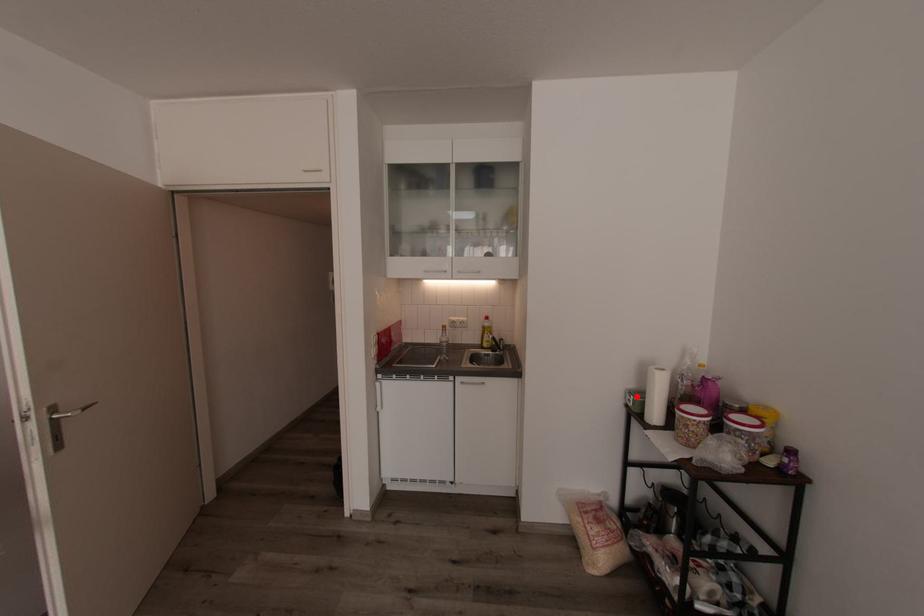
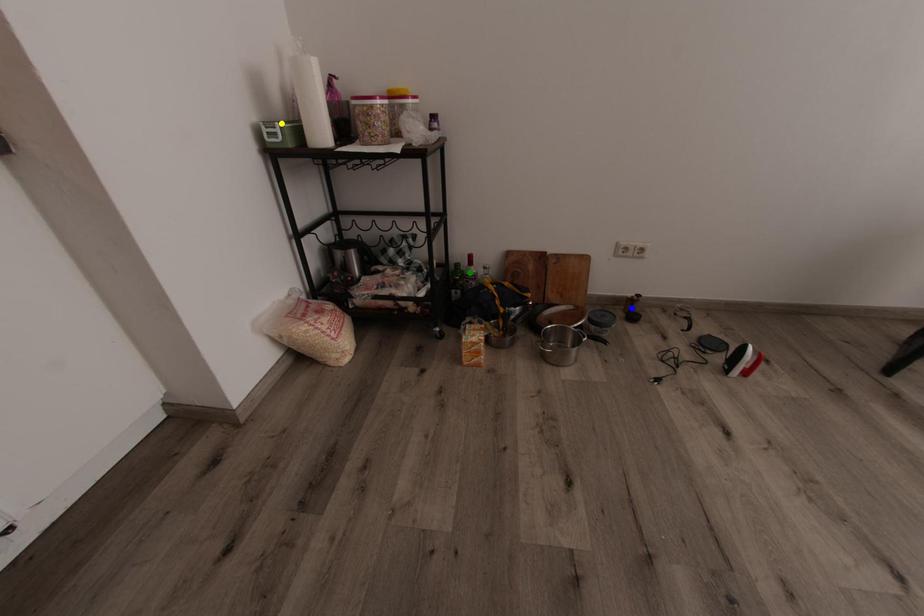
Question: I am providing you with two images of the same scene from different viewpoints. A red point is marked on the first image. You are given multiple points on the second image. Which mark in image 2 goes with the point in image 1?

Choices:
 (A) blue point
 (B) green point
 (C) yellow point

Answer: (C)